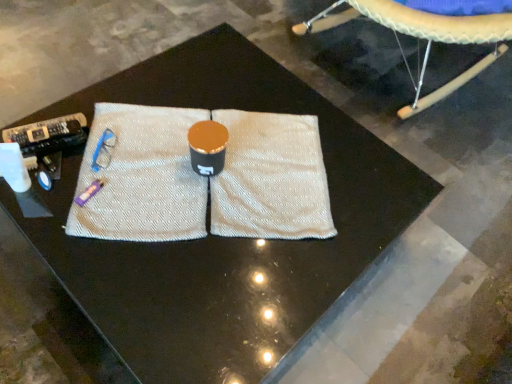
At what (x,y) coordinates should I click in order to perform the action: click on free space to the back side of white textured yoga mat at center. Please return your answer as a coordinate pair (x, y). Image resolution: width=512 pixels, height=384 pixels. Looking at the image, I should click on (197, 82).